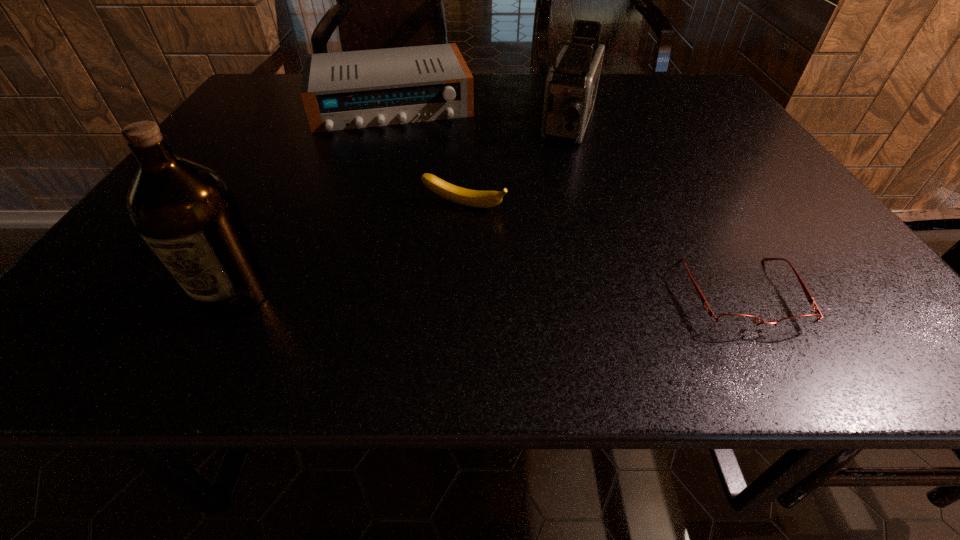
At what (x,y) coordinates should I click in order to perform the action: click on spectacles situated at the near edge. Please return your answer as a coordinate pair (x, y). The height and width of the screenshot is (540, 960). Looking at the image, I should click on (736, 322).

Locate an element on the screen. This screenshot has height=540, width=960. object situated at the right edge is located at coordinates (736, 322).

Where is `object that is at the near right corner`? The height and width of the screenshot is (540, 960). object that is at the near right corner is located at coordinates (736, 322).

At what (x,y) coordinates should I click in order to perform the action: click on free spot at the far edge of the desktop. Please return your answer as a coordinate pair (x, y). The height and width of the screenshot is (540, 960). Looking at the image, I should click on (529, 104).

This screenshot has width=960, height=540. In the image, there is a desktop. Find the location of `blank space at the near edge`. blank space at the near edge is located at coordinates pyautogui.click(x=497, y=264).

In the image, there is a desktop. Where is `vacant region at the left edge`? The image size is (960, 540). vacant region at the left edge is located at coordinates (134, 246).

Find the location of a particular element. This screenshot has height=540, width=960. free space at the right edge of the desktop is located at coordinates (807, 211).

This screenshot has height=540, width=960. What are the coordinates of `vacant area at the far right corner of the desktop` in the screenshot? It's located at (657, 79).

This screenshot has height=540, width=960. In order to click on vacant region at the near right corner of the desktop in this screenshot , I will do (x=802, y=269).

At what (x,y) coordinates should I click in order to perform the action: click on empty space between the second object from right to left and the banana. Please return your answer as a coordinate pair (x, y). Looking at the image, I should click on (517, 166).